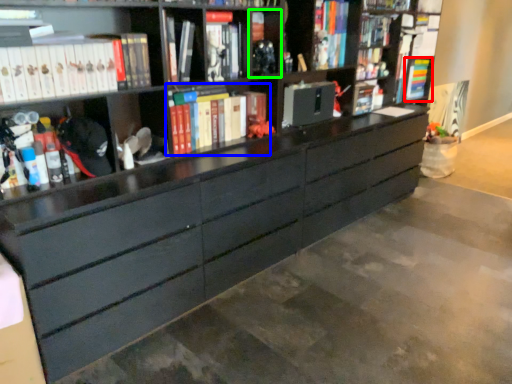
Question: Which object is positioned closest to book (highlighted by a red box)? Select from book (highlighted by a blue box) and cabinet (highlighted by a green box).

Choices:
 (A) book
 (B) cabinet

Answer: (B)